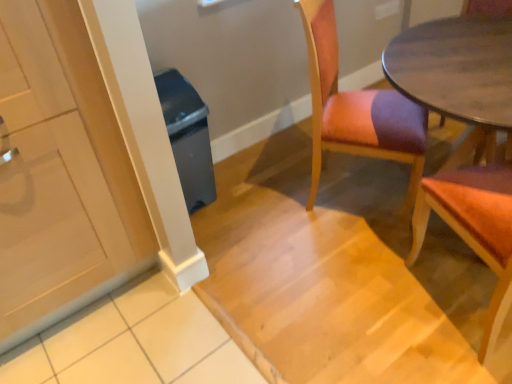
Locate an element on the screen. free point in front of gray plastic trash can at left is located at coordinates point(213,223).